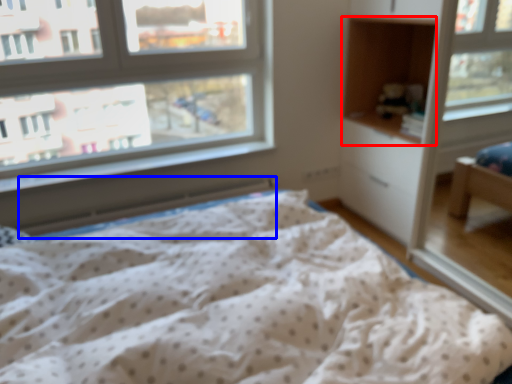
Question: Which object is closer to the camera taking this photo, cabinet (highlighted by a red box) or radiator (highlighted by a blue box)?

Choices:
 (A) cabinet
 (B) radiator

Answer: (A)